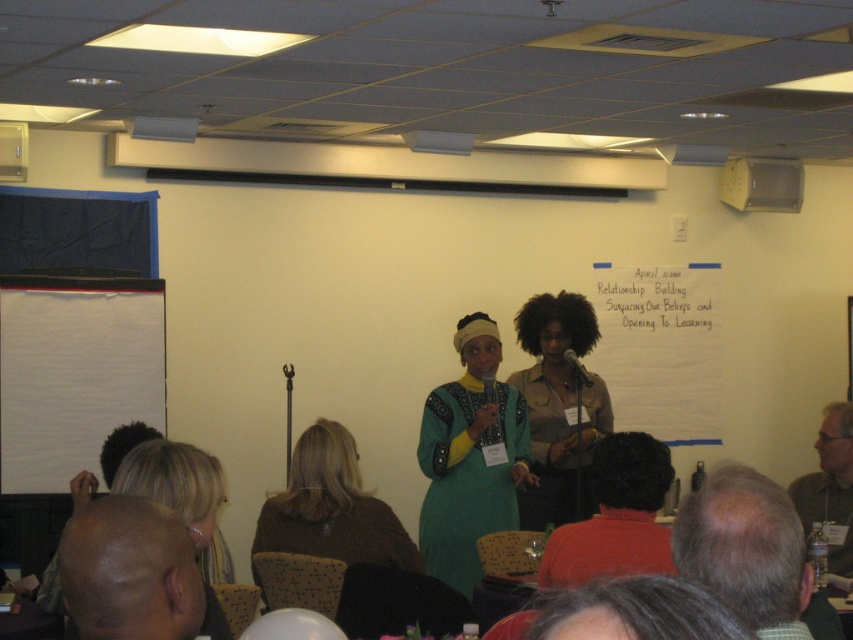
Question: Which is farther from the teal fabric dress at center?

Choices:
 (A) brown fuzzy sweater at lower center
 (B) yellow plastic projector at upper center
 (C) matte khaki shirt at center
 (D) white paperboard at center

Answer: (B)

Question: Is teal fabric dress at center thinner than brown fuzzy sweater at lower center?

Choices:
 (A) yes
 (B) no

Answer: (A)

Question: Which point is farther to the camera?

Choices:
 (A) matte khaki shirt at center
 (B) brown fuzzy sweater at lower center
 (C) teal fabric dress at center

Answer: (A)

Question: Can you confirm if matte khaki shirt at center is smaller than white paperboard at center?

Choices:
 (A) no
 (B) yes

Answer: (A)

Question: Which of the following is the farthest from the observer?

Choices:
 (A) teal fabric dress at center
 (B) white paper at upper left
 (C) yellow plastic projector at upper center

Answer: (C)

Question: Where is teal fabric dress at center located in relation to white paperboard at center in the image?

Choices:
 (A) right
 (B) left

Answer: (B)